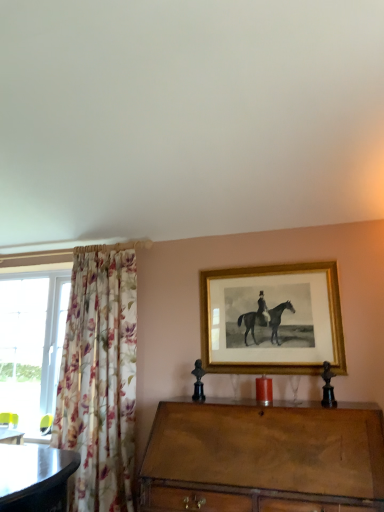
I want to click on free area below gold/gilded picture frame at upper center (from a real-world perspective), so click(271, 395).